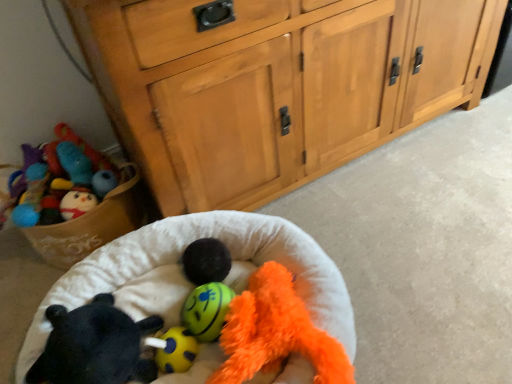
Question: Looking at their shapes, would you say yellow rubber ball at center, the third toy when ordered from right to left, is wider or thinner than black plush bear at lower left, placed as the first toy when sorted from left to right?

Choices:
 (A) thin
 (B) wide

Answer: (A)

Question: Based on their positions, is yellow rubber ball at center, which is the 2th toy in left-to-right order, located to the left or right of black plush bear at lower left, placed as the first toy when sorted from left to right?

Choices:
 (A) right
 (B) left

Answer: (A)

Question: Which of these objects is positioned closest to the wooden cabinet at center?

Choices:
 (A) yellow rubber ball at center, the third toy when ordered from right to left
 (B) yellow rubber ball at center, arranged as the second toy when viewed from the right
 (C) black fuzzy ball at center
 (D) soft plush infant bed at center
 (E) fluffy orange stuffed animal at center, which is the first toy from right to left

Answer: (D)

Question: Based on their relative distances, which object is nearer to the yellow rubber ball at center, arranged as the second toy when viewed from the right?

Choices:
 (A) black fuzzy ball at center
 (B) yellow rubber ball at center, the third toy when ordered from right to left
 (C) black plush bear at lower left, positioned as the 4th toy in right-to-left order
 (D) soft plush infant bed at center
 (E) fluffy orange stuffed animal at center, the fourth toy when ordered from left to right

Answer: (B)